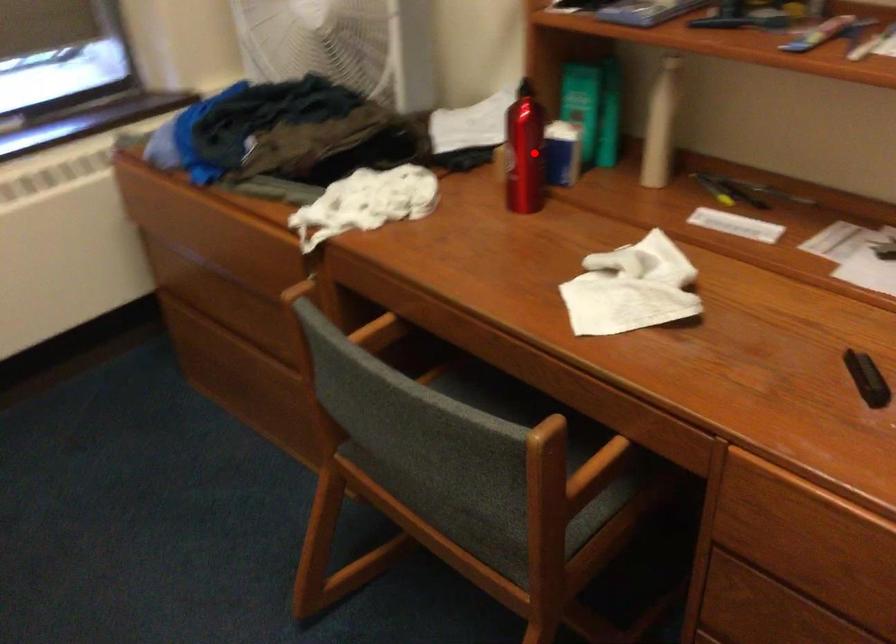
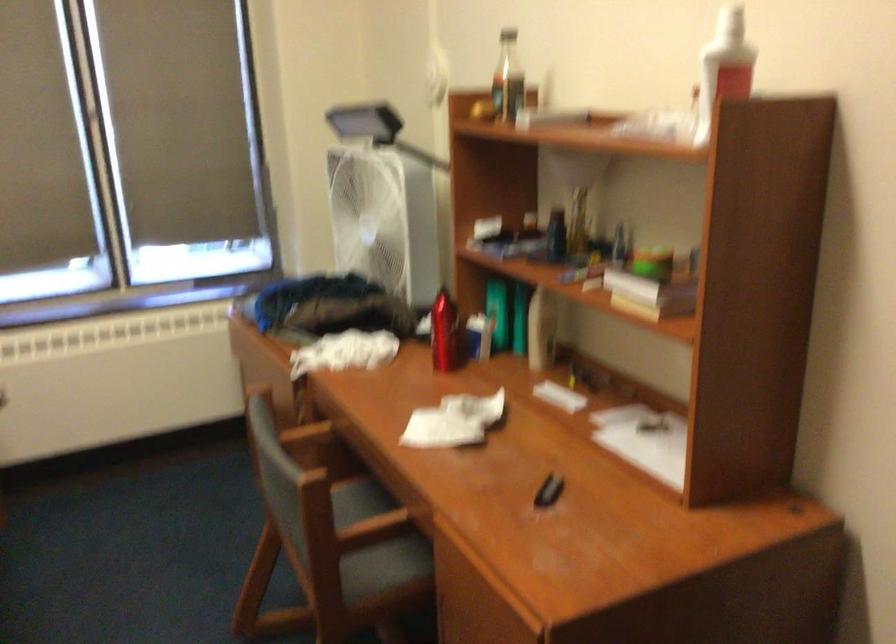
Question: I am providing you with two images of the same scene from different viewpoints. Given a red point in image1, look at the same physical point in image2. Is it:

Choices:
 (A) Closer to the viewpoint
 (B) Farther from the viewpoint

Answer: (B)